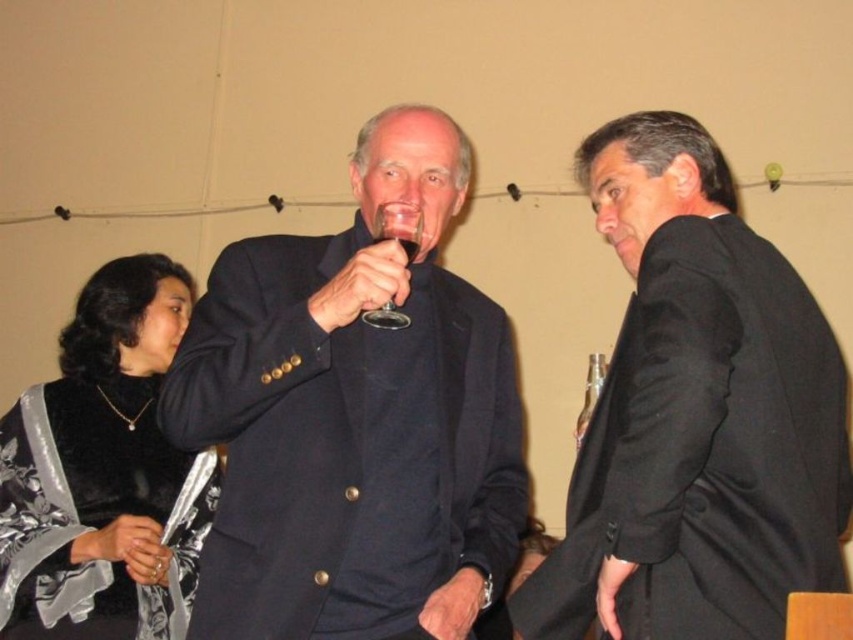
Looking at this image, you are a photographer at the event and need to ensure that the velvet black dress at lower left and the clear glass wine at center are both in focus. Given that your camera can only focus on objects wider than 10 cm, can both objects be captured clearly?

The velvet black dress at lower left is wider than the clear glass wine at center. Since the camera requires objects wider than 10 cm to focus, and the velvet black dress at lower left is larger, it will be in focus. However, the clear glass wine at center may not meet the width requirement. Without knowing the exact measurements, we cannot confirm both will be in focus.

You are a photographer at a formal event and need to position a light source to the right of the clear glass wine at center. Where should you place it relative to the velvet black dress at lower left?

The velvet black dress at lower left is to the left of the clear glass wine at center, so placing the light source to the right of the clear glass wine at center would mean positioning it further to the right of the velvet black dress at lower left.

You are taking a photo of the scene and want to focus on both the point at point (413, 257) and the point at point (381, 237). Which point should you focus on first to ensure both are in sharp focus?

You should focus on point (413, 257) first because it is closer to the camera than point (381, 237). By focusing on the closer point, the farther point will also be in sharp focus due to the depth of field.